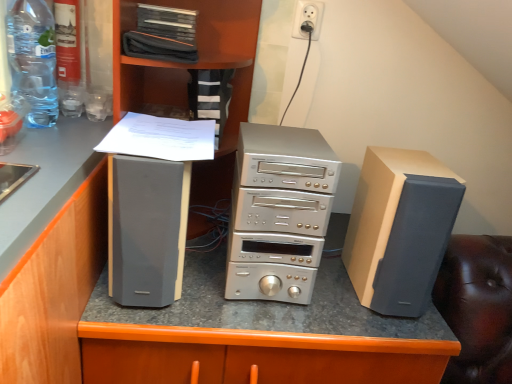
This screenshot has height=384, width=512. Identify the location of free location to the right of silver metallic stereo stack at center. (338, 299).